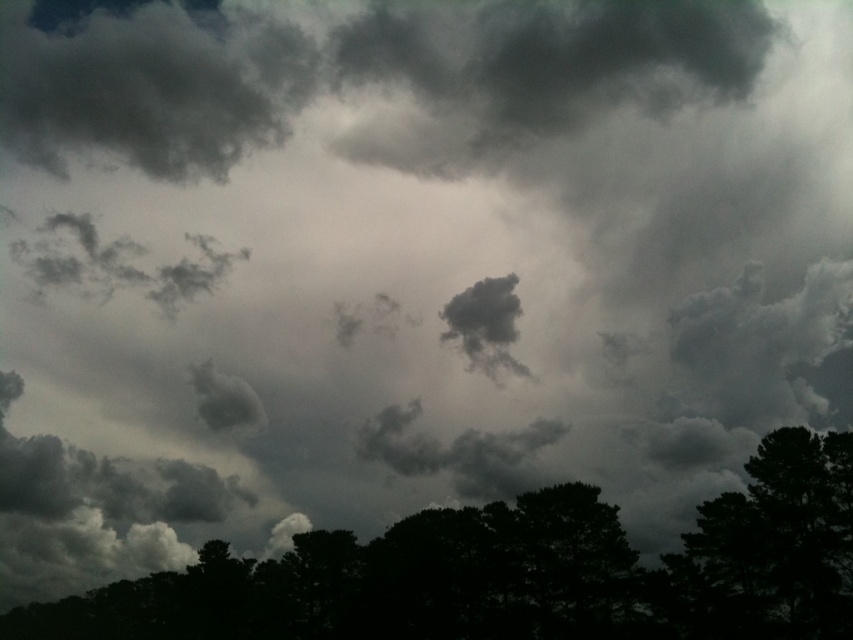
Identify the location of dark green leafy tree at bottom. (519, 572).

What do you see at coordinates (519, 572) in the screenshot? The image size is (853, 640). I see `dark green leafy tree at bottom` at bounding box center [519, 572].

Image resolution: width=853 pixels, height=640 pixels. Identify the location of dark green leafy tree at bottom. (519, 572).